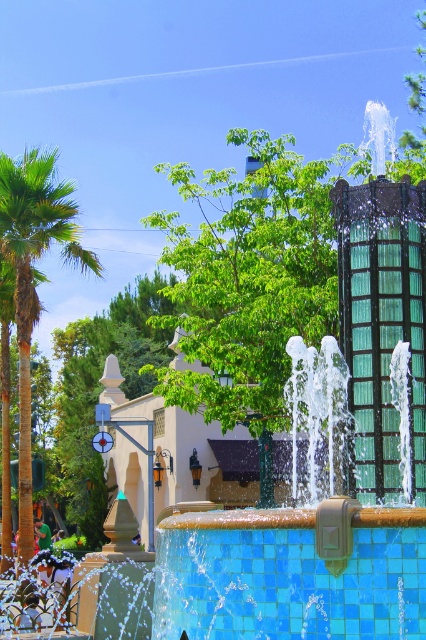
Question: Which point appears farthest from the camera in this image?

Choices:
 (A) (69, 262)
 (B) (420, 616)

Answer: (A)

Question: Is blue mosaic tile swimming pool at center above green leafy palm tree at left?

Choices:
 (A) yes
 (B) no

Answer: (B)

Question: Is blue mosaic tile swimming pool at center to the left of green leafy palm tree at left from the viewer's perspective?

Choices:
 (A) no
 (B) yes

Answer: (A)

Question: Which point is closer to the camera taking this photo?

Choices:
 (A) (291, 561)
 (B) (14, 209)

Answer: (A)

Question: Which point is closer to the camera taking this photo?

Choices:
 (A) (354, 532)
 (B) (19, 275)

Answer: (A)

Question: From the image, what is the correct spatial relationship of blue mosaic tile swimming pool at center in relation to green leafy palm tree at left?

Choices:
 (A) below
 (B) above

Answer: (A)